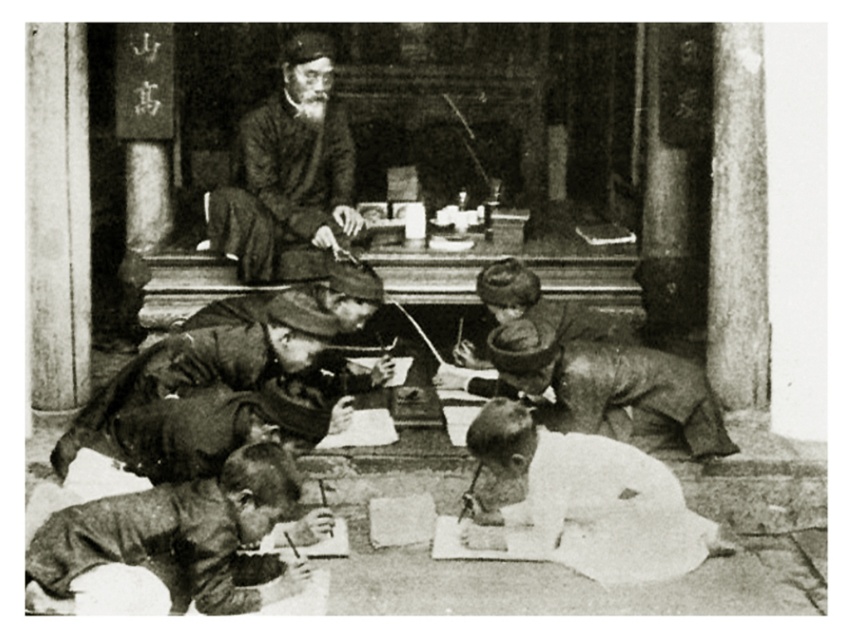
Question: Is smooth stone pillar at right positioned before smooth brown hat at center?

Choices:
 (A) no
 (B) yes

Answer: (A)

Question: Estimate the real-world distances between objects in this image. Which object is closer to the dark brown textured robe at center?

Choices:
 (A) dark brown fabric hat at lower center
 (B) smooth brown hat at center

Answer: (B)

Question: Is dark brown textured robe at center further to camera compared to smooth brown hat at center?

Choices:
 (A) no
 (B) yes

Answer: (B)

Question: Which object appears farthest from the camera in this image?

Choices:
 (A) dark brown fabric hat at lower center
 (B) smooth stone pillar at right
 (C) white paper at lower center

Answer: (B)

Question: Which of the following is the farthest from the observer?

Choices:
 (A) dark brown fabric hat at lower center
 (B) smooth stone pillar at right
 (C) smooth brown jacket at lower left
 (D) white paper at lower center

Answer: (B)

Question: In this image, where is dark brown textured robe at center located relative to smooth brown hat at center?

Choices:
 (A) right
 (B) left

Answer: (B)